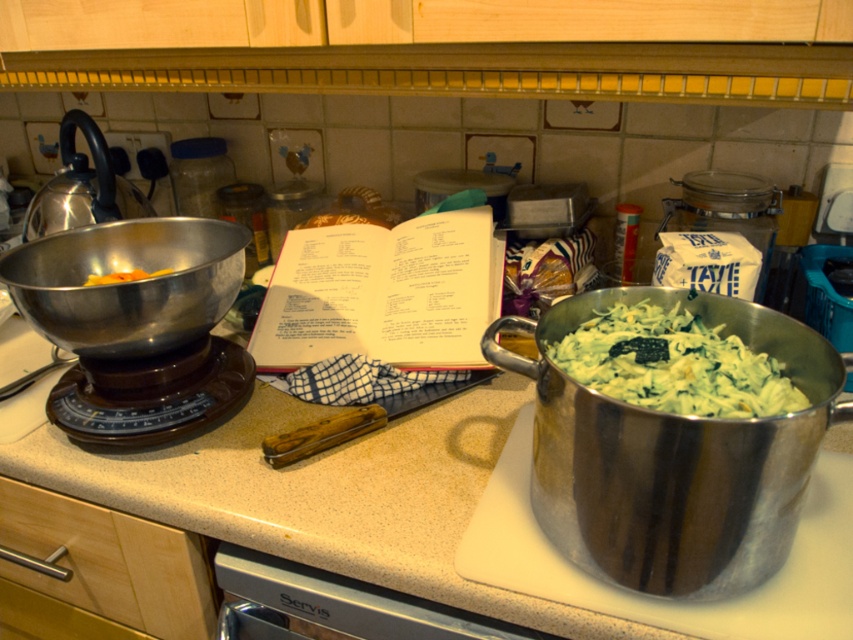
Question: Is metallic bowl at left thinner than yellow rubber band at left?

Choices:
 (A) yes
 (B) no

Answer: (B)

Question: Does metallic bowl at left come in front of yellow rubber band at left?

Choices:
 (A) no
 (B) yes

Answer: (B)

Question: Which point is farther to the camera?

Choices:
 (A) beige laminate countertop at center
 (B) green creamy salad at center
 (C) yellow rubber band at left
 (D) metallic bowl at left

Answer: (C)

Question: Considering the real-world distances, which object is farthest from the beige laminate countertop at center?

Choices:
 (A) green creamy salad at center
 (B) yellow rubber band at left
 (C) metallic bowl at left

Answer: (B)

Question: Does beige laminate countertop at center have a lesser width compared to green creamy salad at center?

Choices:
 (A) yes
 (B) no

Answer: (B)

Question: Estimate the real-world distances between objects in this image. Which object is closer to the metallic bowl at left?

Choices:
 (A) yellow rubber band at left
 (B) green creamy salad at center

Answer: (A)